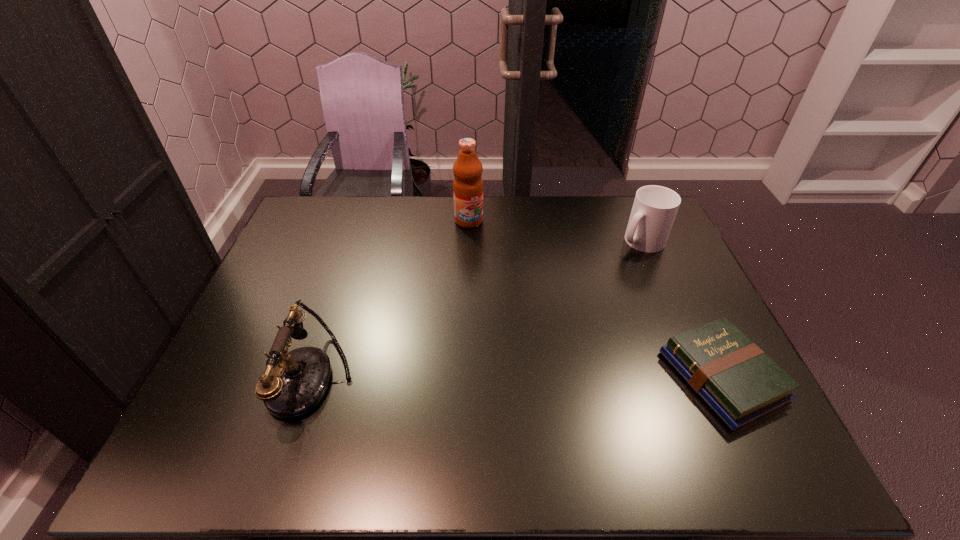
Image resolution: width=960 pixels, height=540 pixels. Identify the location of vacant space that satisfies the following two spatial constraints: 1. on the front side of the fruit juice; 2. on the right side of the book. (464, 376).

Find the location of a particular element. vacant region that satisfies the following two spatial constraints: 1. on the front side of the shortest object; 2. on the right side of the fruit juice is located at coordinates (464, 376).

The image size is (960, 540). What are the coordinates of `vacant space that satisfies the following two spatial constraints: 1. on the front side of the tallest object; 2. on the left side of the mug` in the screenshot? It's located at (468, 241).